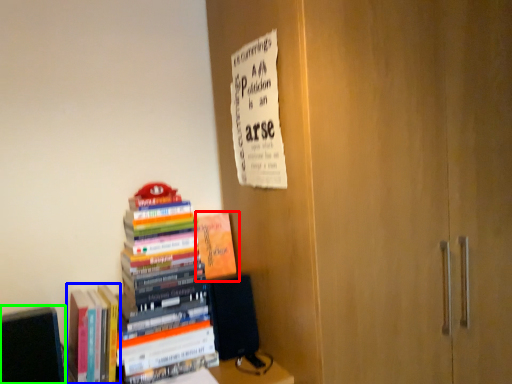
Question: Considering the real-world distances, which object is closest to book (highlighted by a red box)? book (highlighted by a blue box) or book (highlighted by a green box).

Choices:
 (A) book
 (B) book

Answer: (A)